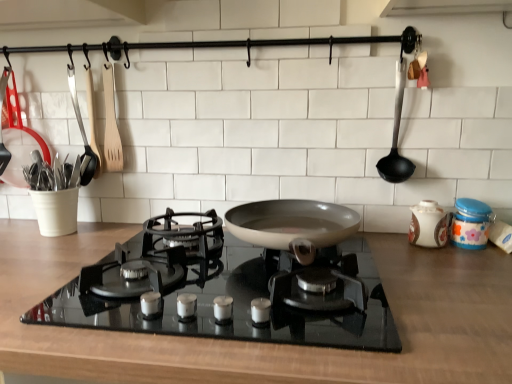
Question: Is black plastic ladle at right completely or partially inside wooden spatula at left, which ranks as the 4th kitchen appliance in right-to-left order?

Choices:
 (A) no
 (B) yes

Answer: (A)

Question: From a real-world perspective, does wooden spatula at left, which appears as the 2th kitchen appliance when viewed from the left, stand above black plastic ladle at right?

Choices:
 (A) no
 (B) yes

Answer: (B)

Question: Is wooden spatula at left, which appears as the 2th kitchen appliance when viewed from the left, wider than black plastic ladle at right?

Choices:
 (A) no
 (B) yes

Answer: (A)

Question: Is wooden spatula at left, which appears as the 2th kitchen appliance when viewed from the left, oriented towards black plastic ladle at right?

Choices:
 (A) no
 (B) yes

Answer: (A)

Question: Can you confirm if wooden spatula at left, which ranks as the 4th kitchen appliance in right-to-left order, is smaller than black plastic ladle at right?

Choices:
 (A) no
 (B) yes

Answer: (B)

Question: From the image's perspective, is wooden spatula at left, which ranks as the 4th kitchen appliance in right-to-left order, located above black plastic ladle at right?

Choices:
 (A) no
 (B) yes

Answer: (B)

Question: Is porcelain jar at right, which is counted as the 2th kitchen appliance, starting from the right, to the right of white plastic utensil holder at left, placed as the fifth kitchen appliance when sorted from right to left, from the viewer's perspective?

Choices:
 (A) yes
 (B) no

Answer: (A)

Question: Does porcelain jar at right, the fourth kitchen appliance when ordered from left to right, have a larger size compared to white plastic utensil holder at left, the 1th kitchen appliance from the left?

Choices:
 (A) yes
 (B) no

Answer: (B)

Question: From a real-world perspective, does porcelain jar at right, which is counted as the 2th kitchen appliance, starting from the right, sit lower than white plastic utensil holder at left, the 1th kitchen appliance from the left?

Choices:
 (A) yes
 (B) no

Answer: (A)

Question: Is porcelain jar at right, which is counted as the 2th kitchen appliance, starting from the right, shorter than white plastic utensil holder at left, placed as the fifth kitchen appliance when sorted from right to left?

Choices:
 (A) no
 (B) yes

Answer: (B)

Question: Does porcelain jar at right, the fourth kitchen appliance when ordered from left to right, have a greater height compared to white plastic utensil holder at left, placed as the fifth kitchen appliance when sorted from right to left?

Choices:
 (A) yes
 (B) no

Answer: (B)

Question: Is porcelain jar at right, which is counted as the 2th kitchen appliance, starting from the right, behind white plastic utensil holder at left, the 1th kitchen appliance from the left?

Choices:
 (A) yes
 (B) no

Answer: (B)

Question: Is white plastic utensil holder at left, the 1th kitchen appliance from the left, turned away from blue glossy jar at right, marked as the 1th kitchen appliance in a right-to-left arrangement?

Choices:
 (A) yes
 (B) no

Answer: (B)